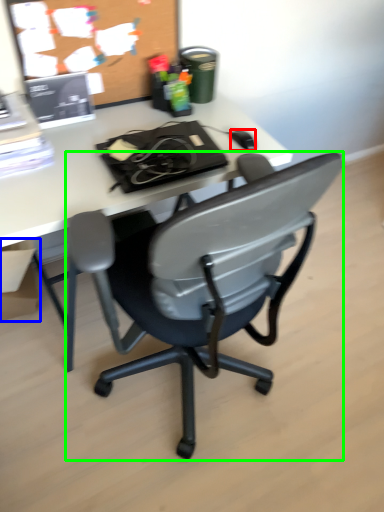
Question: Considering the real-world distances, which object is farthest from mouse (highlighted by a red box)? box (highlighted by a blue box) or chair (highlighted by a green box)?

Choices:
 (A) box
 (B) chair

Answer: (A)